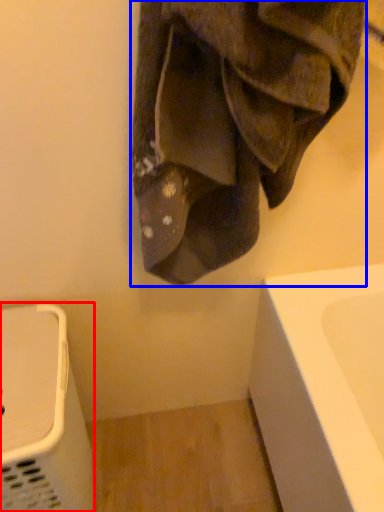
Question: Which object is closer to the camera taking this photo, appliance (highlighted by a red box) or towel (highlighted by a blue box)?

Choices:
 (A) appliance
 (B) towel

Answer: (B)